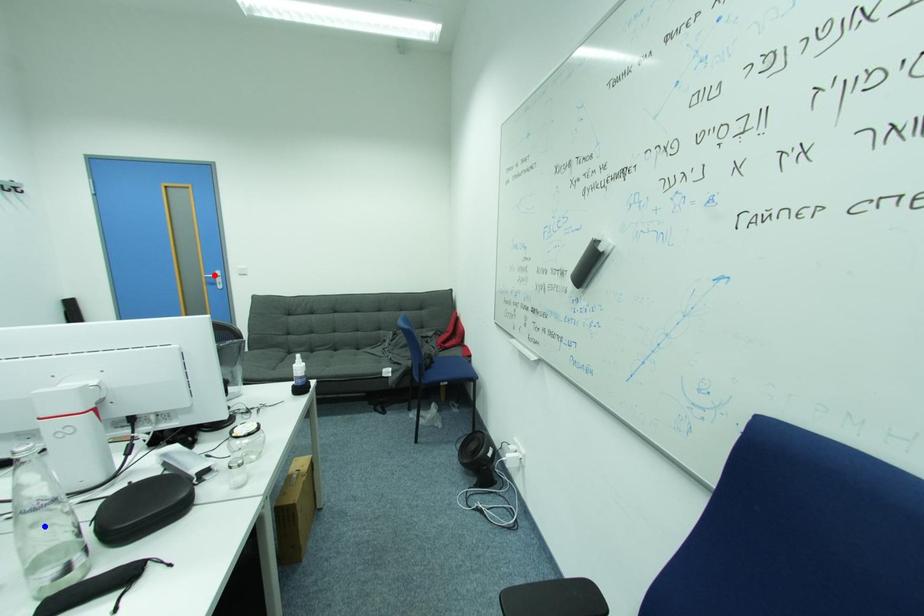
Question: In the image, two points are highlighted. Which point is nearer to the camera? Reply with the corresponding letter.

Choices:
 (A) blue point
 (B) red point

Answer: (A)